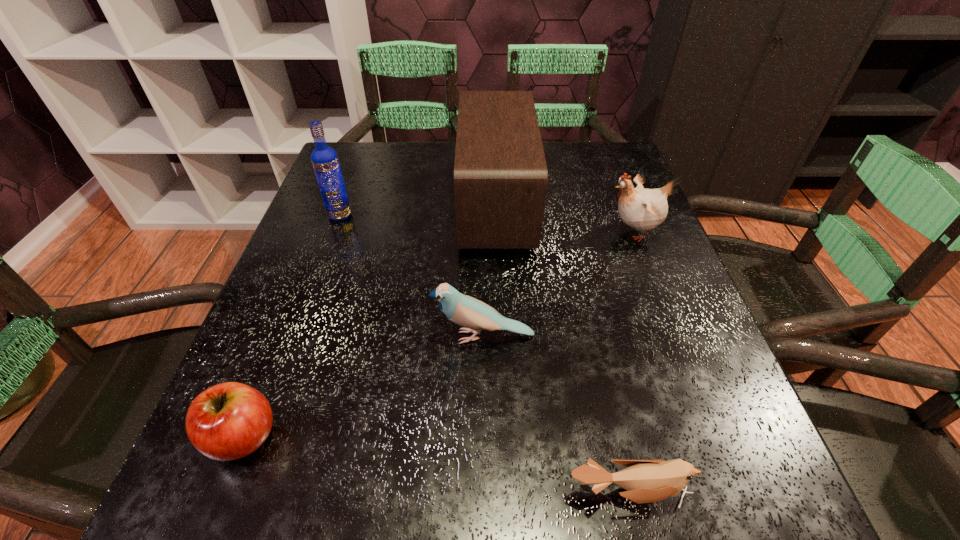
Find the location of a particular element. vacant space at the right edge of the desktop is located at coordinates (650, 371).

In the image, there is a desktop. At what (x,y) coordinates should I click in order to perform the action: click on free space at the far left corner. Please return your answer as a coordinate pair (x, y). The height and width of the screenshot is (540, 960). Looking at the image, I should click on (367, 141).

You are a GUI agent. You are given a task and a screenshot of the screen. Output one action in this format:
    pyautogui.click(x=<x>, y=<y>)
    Task: Click on the free space between the second nearest bird and the farthest bird
    
    Given the screenshot: What is the action you would take?
    pyautogui.click(x=557, y=284)

The width and height of the screenshot is (960, 540). Find the location of `free spot between the second shortest object and the third nearest object`. free spot between the second shortest object and the third nearest object is located at coordinates (362, 386).

Locate an element on the screen. blank region between the farthest bird and the leftmost bird is located at coordinates (557, 284).

The image size is (960, 540). In order to click on vacant area between the second nearest object and the radio receiver in this screenshot , I will do `click(370, 321)`.

Where is `free space between the second nearest object and the radio receiver`? The width and height of the screenshot is (960, 540). free space between the second nearest object and the radio receiver is located at coordinates (370, 321).

Identify the location of blank region between the nearest object and the farthest bird. (631, 363).

Locate an element on the screen. The height and width of the screenshot is (540, 960). vacant area between the farthest bird and the radio receiver is located at coordinates pyautogui.click(x=564, y=219).

Locate an element on the screen. This screenshot has width=960, height=540. vacant area that lies between the radio receiver and the farthest bird is located at coordinates (564, 219).